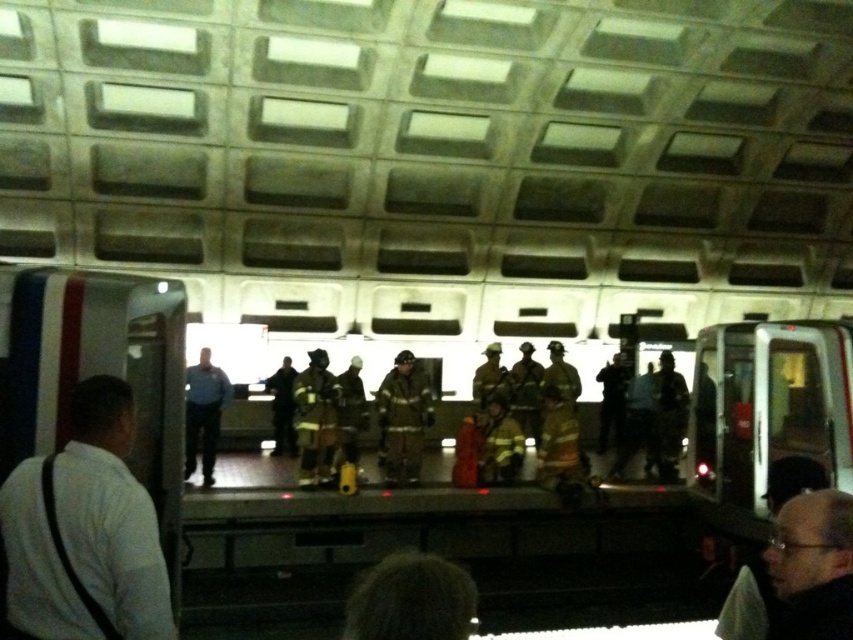
Is white shirt at left to the left of metallic silver train at right from the viewer's perspective?

Correct, you'll find white shirt at left to the left of metallic silver train at right.

How distant is white shirt at left from metallic silver train at right?

white shirt at left is 6.38 meters away from metallic silver train at right.

In order to click on white shirt at left in this screenshot , I will do `click(84, 532)`.

Does smooth black hair at lower right lie in front of dark gray uniform at center?

That is True.

Is smooth black hair at lower right wider than dark gray uniform at center?

No, smooth black hair at lower right is not wider than dark gray uniform at center.

Is point (804, 522) closer to viewer compared to point (659, 426)?

Yes, point (804, 522) is closer to viewer.

Locate an element on the screen. This screenshot has width=853, height=640. smooth black hair at lower right is located at coordinates (811, 566).

Does metallic silver train at right have a smaller size compared to dark gray uniform at center?

No.

Between metallic silver train at right and dark gray uniform at center, which one has less height?

dark gray uniform at center is shorter.

The width and height of the screenshot is (853, 640). Find the location of `metallic silver train at right`. metallic silver train at right is located at coordinates (767, 412).